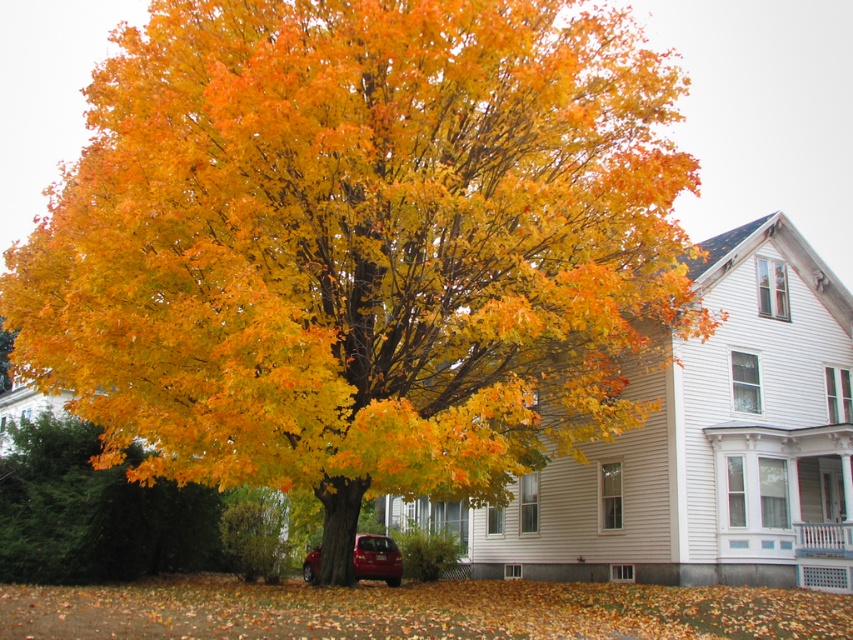
You are a delivery person trying to park your 4.5 meter long van between the golden yellow leaves at lower left and the shiny red sedan at lower center. Can your van fit in the space between them?

The golden yellow leaves at lower left and shiny red sedan at lower center are 5.35 meters apart from each other. Since the van is 4.5 meters long, it can fit in the space between them as the distance is greater than the van length.

Looking at this image, you are standing in the yard looking at the golden yellow leaves at lower left and the shiny red sedan at lower center. Which object is nearer to you?

The golden yellow leaves at lower left are closer to the viewer than the shiny red sedan at lower center.

You are standing in the yard looking at the house and the large tree with golden yellow leaves. There is a point marked at coordinates (94, 512). Where is this point located relative to the golden yellow leaves at lower left?

The point (94, 512) is located on the golden yellow leaves at lower left.